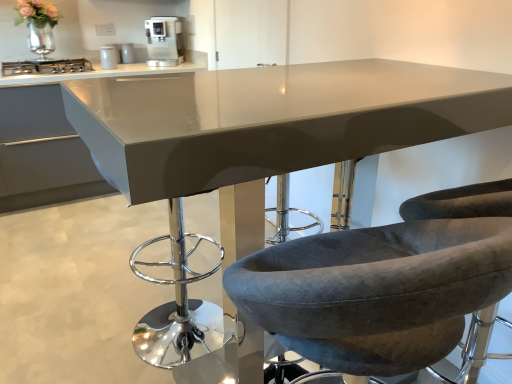
Question: Is velvet grey chair at center, arranged as the 1th chair when viewed from the left, smaller than metallic silver canister at upper center, the 2th appliance from the front?

Choices:
 (A) no
 (B) yes

Answer: (A)

Question: Is velvet grey chair at center, the second chair positioned from the right, behind metallic silver canister at upper center, which appears as the 1th appliance when viewed from the back?

Choices:
 (A) yes
 (B) no

Answer: (B)

Question: Is velvet grey chair at center, the second chair positioned from the right, not close to metallic silver canister at upper center, positioned as the first appliance in top-to-bottom order?

Choices:
 (A) no
 (B) yes

Answer: (B)

Question: Is velvet grey chair at center, arranged as the 1th chair when viewed from the left, thinner than metallic silver canister at upper center, the second appliance positioned from the bottom?

Choices:
 (A) no
 (B) yes

Answer: (A)

Question: From the image's perspective, is velvet grey chair at center, the second chair positioned from the right, beneath metallic silver canister at upper center, which appears as the 1th appliance when viewed from the back?

Choices:
 (A) yes
 (B) no

Answer: (A)

Question: From the image's perspective, is satin white countertop at upper left positioned above or below velvet grey chair at center, arranged as the 1th chair when viewed from the left?

Choices:
 (A) above
 (B) below

Answer: (A)

Question: Based on their sizes in the image, would you say satin white countertop at upper left is bigger or smaller than velvet grey chair at center, arranged as the 1th chair when viewed from the left?

Choices:
 (A) big
 (B) small

Answer: (A)

Question: Relative to velvet grey chair at center, arranged as the 1th chair when viewed from the left, is satin white countertop at upper left in front or behind?

Choices:
 (A) behind
 (B) front

Answer: (A)

Question: Considering the positions of point (131, 67) and point (381, 235), is point (131, 67) closer or farther from the camera than point (381, 235)?

Choices:
 (A) closer
 (B) farther

Answer: (B)

Question: Would you say metallic silver canister at upper center, positioned as the first appliance in top-to-bottom order, is to the left or to the right of satin silver coffee machine at upper center in the picture?

Choices:
 (A) right
 (B) left

Answer: (B)

Question: Is metallic silver canister at upper center, the second appliance positioned from the bottom, inside or outside of satin silver coffee machine at upper center?

Choices:
 (A) outside
 (B) inside

Answer: (A)

Question: From a real-world perspective, is metallic silver canister at upper center, positioned as the first appliance in top-to-bottom order, above or below satin silver coffee machine at upper center?

Choices:
 (A) below
 (B) above

Answer: (A)

Question: Is metallic silver canister at upper center, the second appliance positioned from the bottom, in front of or behind satin silver coffee machine at upper center in the image?

Choices:
 (A) behind
 (B) front

Answer: (A)

Question: Is stainless steel stove at left inside the boundaries of satin silver coffee machine at upper center, or outside?

Choices:
 (A) inside
 (B) outside

Answer: (B)

Question: Is point (84, 66) positioned closer to the camera than point (167, 29)?

Choices:
 (A) closer
 (B) farther

Answer: (A)